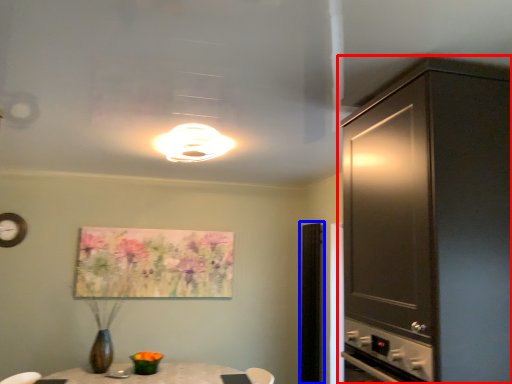
Question: Which of the following is the farthest to the observer, cabinetry (highlighted by a red box) or glass door (highlighted by a blue box)?

Choices:
 (A) cabinetry
 (B) glass door

Answer: (B)